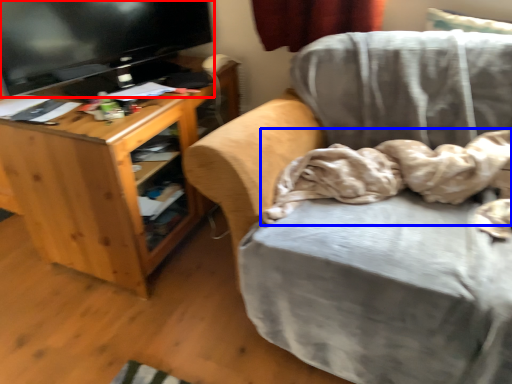
Question: Which point is further to the camera, television (highlighted by a red box) or blanket (highlighted by a blue box)?

Choices:
 (A) television
 (B) blanket

Answer: (A)